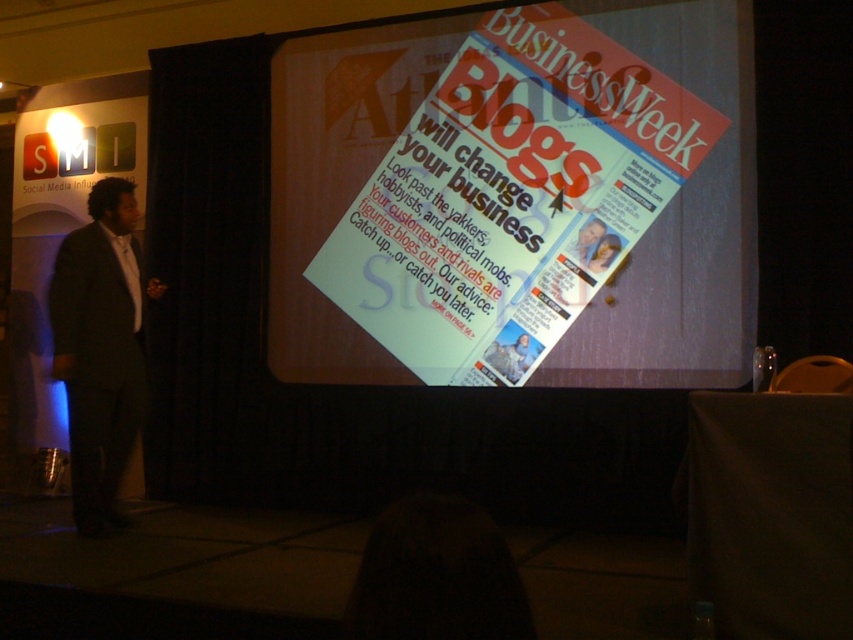
Question: Does matte paper magazine at center appear over dark gray suit at left?

Choices:
 (A) yes
 (B) no

Answer: (A)

Question: Does matte paper magazine at center come behind dark gray suit at left?

Choices:
 (A) no
 (B) yes

Answer: (B)

Question: Does matte paper magazine at center appear on the left side of dark gray suit at left?

Choices:
 (A) no
 (B) yes

Answer: (A)

Question: Which object is closer to the camera taking this photo?

Choices:
 (A) matte paper magazine at center
 (B) dark gray suit at left

Answer: (B)